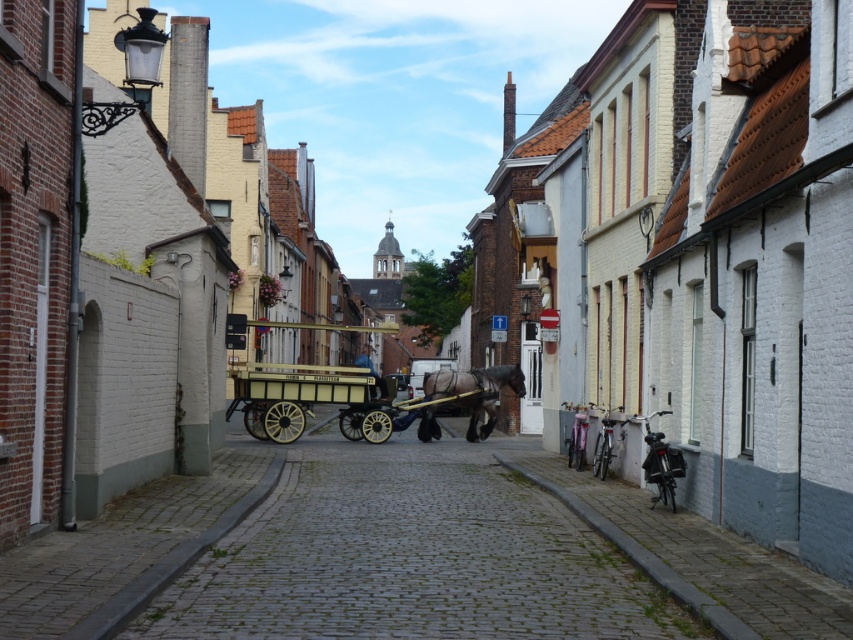
Question: Among these points, which one is farthest from the camera?

Choices:
 (A) (364, 349)
 (B) (337, 381)

Answer: (A)

Question: Is wooden polished cart at center above wooden polished coach at center?

Choices:
 (A) no
 (B) yes

Answer: (B)

Question: Among these objects, which one is nearest to the camera?

Choices:
 (A) wooden polished cart at center
 (B) wooden polished coach at center

Answer: (A)

Question: Can you confirm if dark brown glossy horse at center is positioned below wooden polished coach at center?

Choices:
 (A) yes
 (B) no

Answer: (B)

Question: Considering the real-world distances, which object is closest to the wooden polished coach at center?

Choices:
 (A) dark brown glossy horse at center
 (B) wooden polished cart at center

Answer: (A)

Question: From the image, what is the correct spatial relationship of wooden polished cart at center in relation to wooden polished coach at center?

Choices:
 (A) above
 (B) below

Answer: (A)